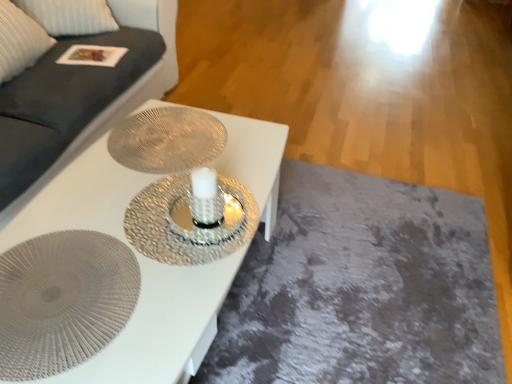
Question: From a real-world perspective, is metallic textured plate at center, positioned as the 2th oval in bottom-to-top order, above or below white textured table at center?

Choices:
 (A) above
 (B) below

Answer: (A)

Question: Is metallic textured plate at center, positioned as the 2th oval in bottom-to-top order, taller or shorter than white textured table at center?

Choices:
 (A) tall
 (B) short

Answer: (B)

Question: Which of these objects is positioned farthest from the metallic textured plate at center, the 2th oval when ordered from front to back?

Choices:
 (A) dark gray fabric couch at upper left
 (B) white textured table at center
 (C) textured silver plate at center, positioned as the first oval in front-to-back order

Answer: (A)

Question: Estimate the real-world distances between objects in this image. Which object is closer to the dark gray fabric couch at upper left?

Choices:
 (A) white textured table at center
 (B) metallic textured plate at center, the 2th oval when ordered from front to back
 (C) textured silver plate at center, positioned as the first oval in front-to-back order

Answer: (B)